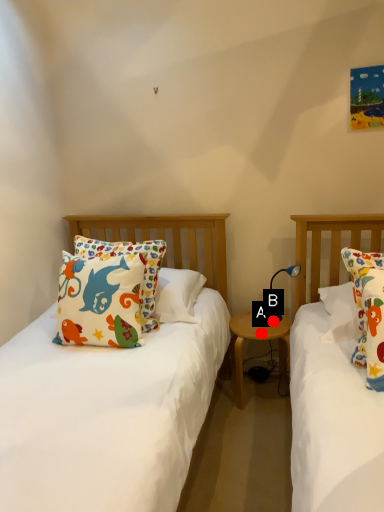
Question: Two points are circled on the image, labeled by A and B beside each circle. Among these points, which one is nearest to the camera?

Choices:
 (A) A is closer
 (B) B is closer

Answer: (A)